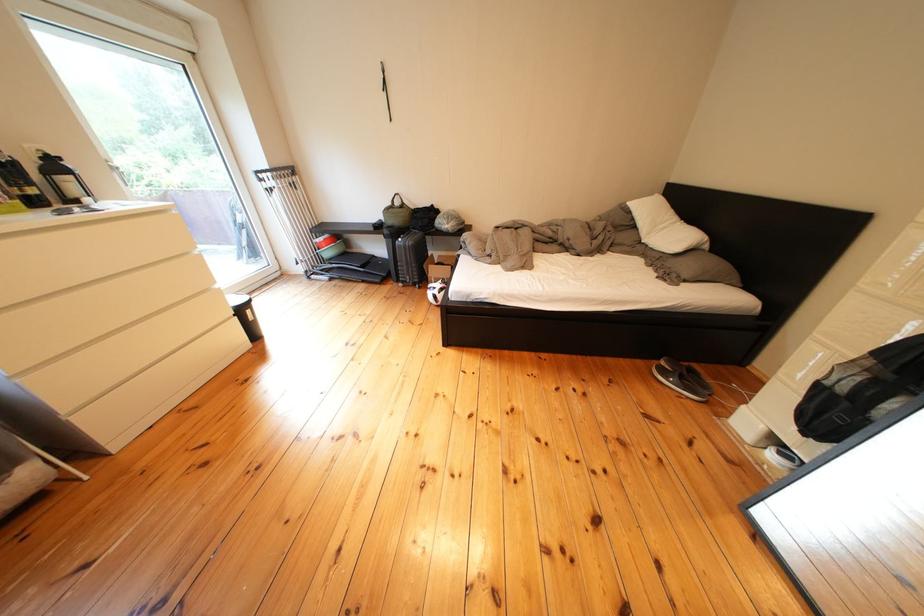
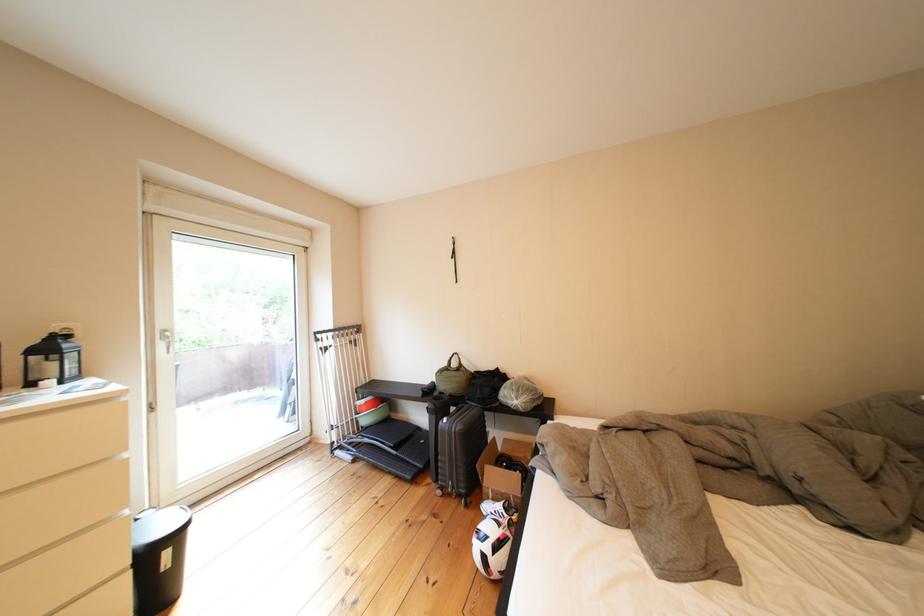
The point at (x=448, y=301) is marked in the first image. Where is the corresponding point in the second image?

(499, 562)